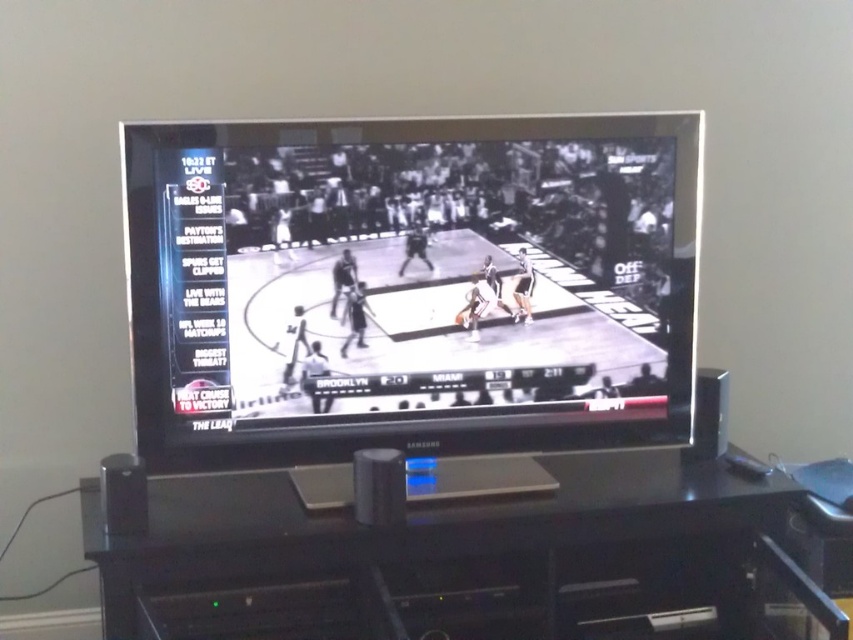
Is point (259, 332) positioned after point (94, 516)?

Yes, point (259, 332) is behind point (94, 516).

Can you confirm if black glossy basketball court at center is bigger than black plastic entertainment center at lower center?

No.

Find the location of `black glossy basketball court at center`. black glossy basketball court at center is located at coordinates (410, 275).

Identify the location of black glossy basketball court at center. (410, 275).